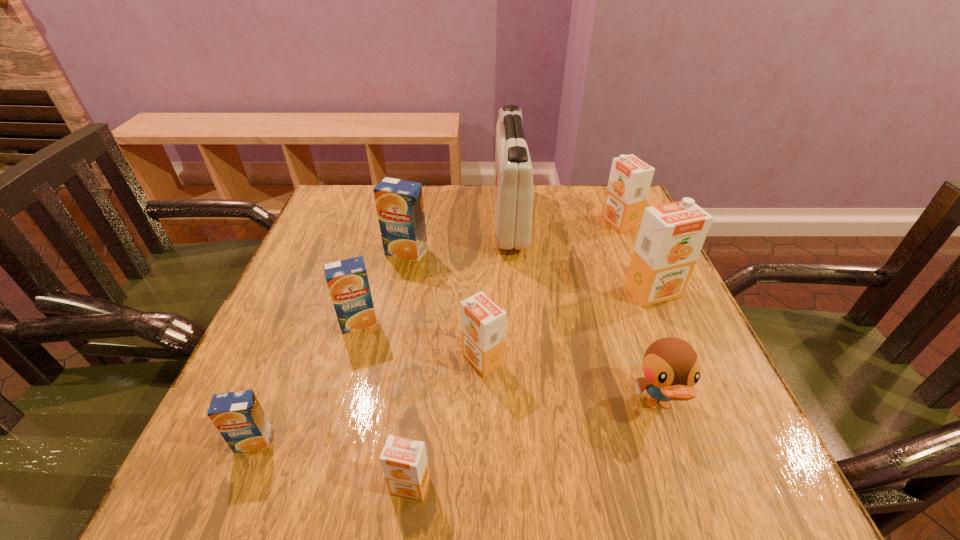
You are a GUI agent. You are given a task and a screenshot of the screen. Output one action in this format:
    pyautogui.click(x=<x>, y=<y>)
    Task: Click on the vacant space located 0.080m on the left of the biggest orange orange juice
    This screenshot has height=540, width=960.
    Given the screenshot: What is the action you would take?
    pyautogui.click(x=588, y=292)

Find the location of a particular element. The width and height of the screenshot is (960, 540). free region located 0.160m on the back of the biggest blue orange_juice is located at coordinates (416, 207).

Identify the location of free region located 0.220m on the left of the farthest orange juice. Image resolution: width=960 pixels, height=540 pixels. click(520, 222).

Image resolution: width=960 pixels, height=540 pixels. I want to click on vacant area located on the back of the second nearest blue orange_juice, so click(x=374, y=265).

Locate an element on the screen. free location located 0.310m on the left of the third nearest orange juice is located at coordinates (296, 359).

Identify the location of vacant space located 0.100m on the front-facing side of the blue duck. This screenshot has width=960, height=540. (690, 497).

At what (x,y) coordinates should I click in order to perform the action: click on vacant space located on the right of the sixth farthest orange juice. Please return your answer as a coordinate pair (x, y). The height and width of the screenshot is (540, 960). Looking at the image, I should click on (449, 441).

This screenshot has width=960, height=540. Find the location of `vacant area situated 0.180m on the left of the nearest orange juice`. vacant area situated 0.180m on the left of the nearest orange juice is located at coordinates (268, 485).

Locate an element on the screen. This screenshot has height=540, width=960. the first-aid kit located in the far edge section of the desktop is located at coordinates (513, 194).

Locate an element on the screen. orange juice located in the far edge section of the desktop is located at coordinates (630, 178).